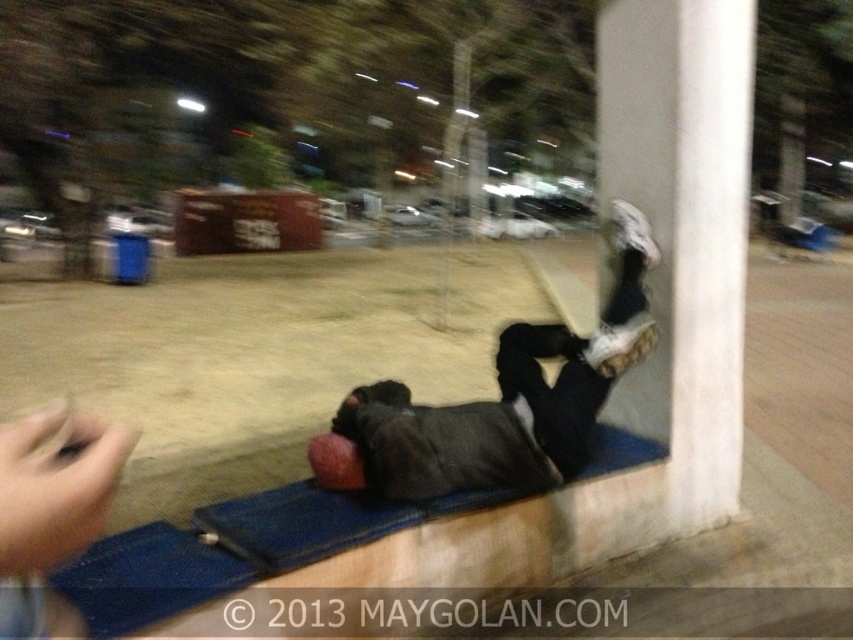
Which of these two, white smooth pillar at upper right or dark gray fabric at lower right, stands shorter?

dark gray fabric at lower right

Can you confirm if white smooth pillar at upper right is smaller than dark gray fabric at lower right?

Indeed, white smooth pillar at upper right has a smaller size compared to dark gray fabric at lower right.

Does point (737, 83) come closer to viewer compared to point (370, 413)?

No.

What are the coordinates of `white smooth pillar at upper right` in the screenshot? It's located at (683, 228).